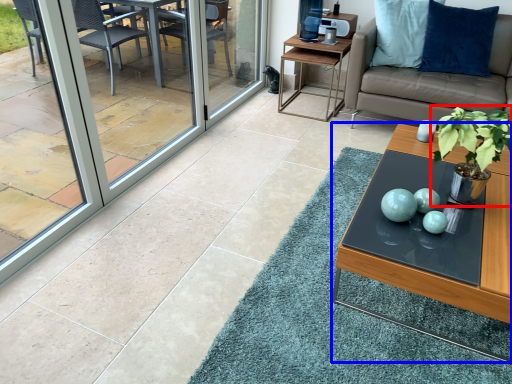
Question: Which object appears closest to the camera in this image, houseplant (highlighted by a red box) or coffee table (highlighted by a blue box)?

Choices:
 (A) houseplant
 (B) coffee table

Answer: (B)